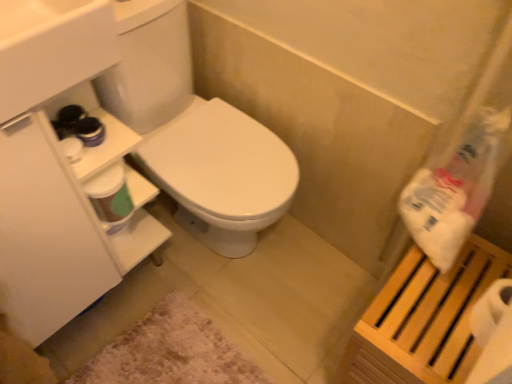
Question: From a real-world perspective, is wooden slatted shelf at right above or below white glossy sink at upper left?

Choices:
 (A) below
 (B) above

Answer: (A)

Question: Considering their positions, is wooden slatted shelf at right located in front of or behind white glossy sink at upper left?

Choices:
 (A) front
 (B) behind

Answer: (B)

Question: Which is farther from the white plastic bag at upper right?

Choices:
 (A) white fluffy bath mat at lower center
 (B) white glossy sink at upper left
 (C) wooden slatted shelf at right
 (D) white matte toilet paper at right

Answer: (A)

Question: Which of these objects is positioned farthest from the white fluffy bath mat at lower center?

Choices:
 (A) white plastic bag at upper right
 (B) white matte toilet paper at right
 (C) white glossy sink at upper left
 (D) wooden slatted shelf at right

Answer: (C)